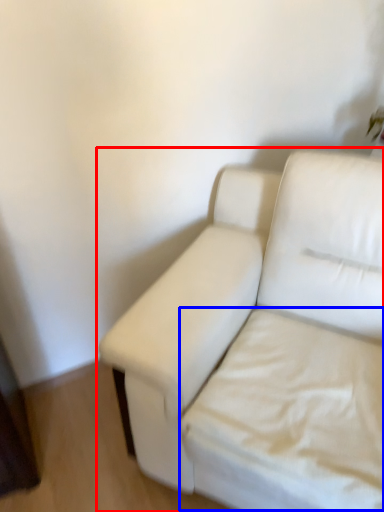
Question: Which of the following is the closest to the observer, studio couch (highlighted by a red box) or sheet (highlighted by a blue box)?

Choices:
 (A) studio couch
 (B) sheet

Answer: (A)